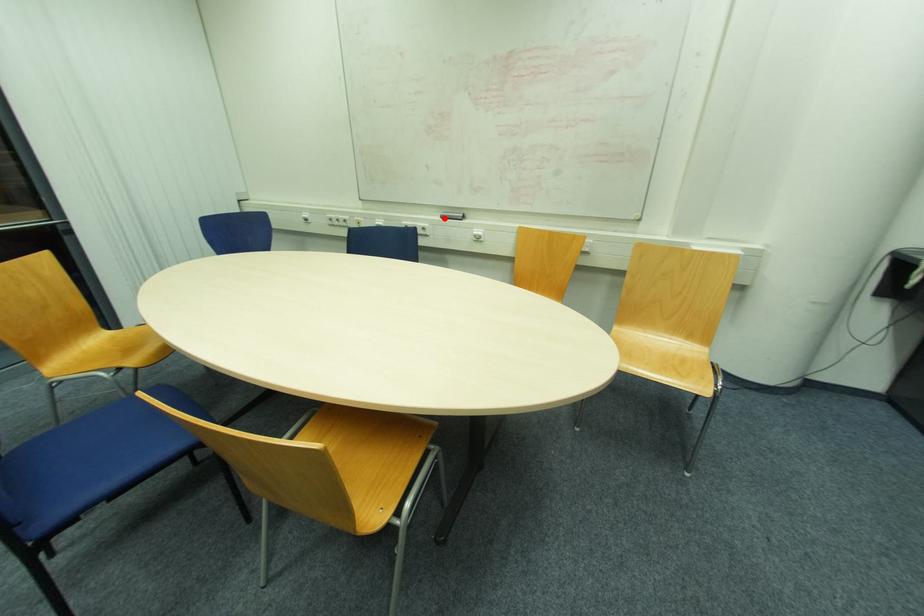
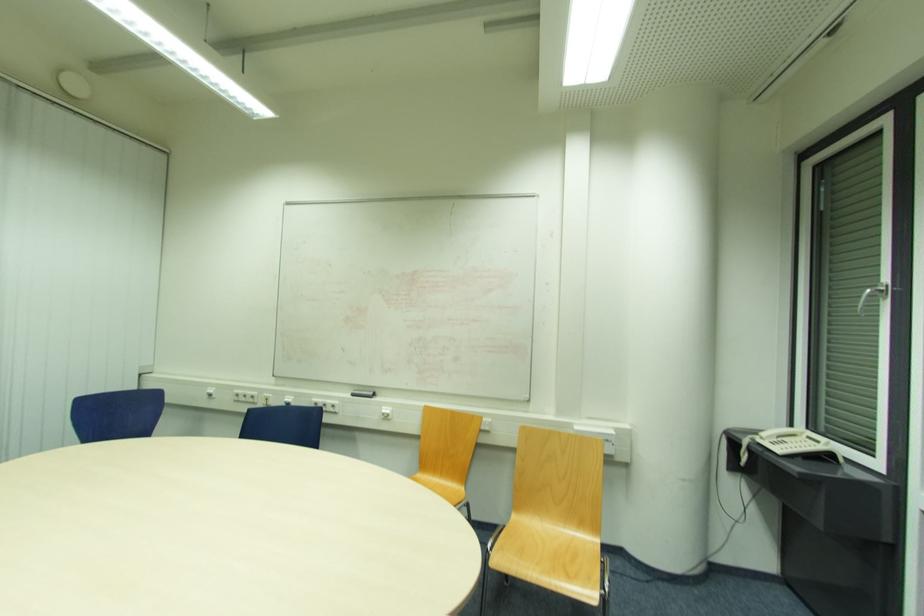
In the second image, find the point that corresponds to the highlighted location in the first image.

(355, 395)